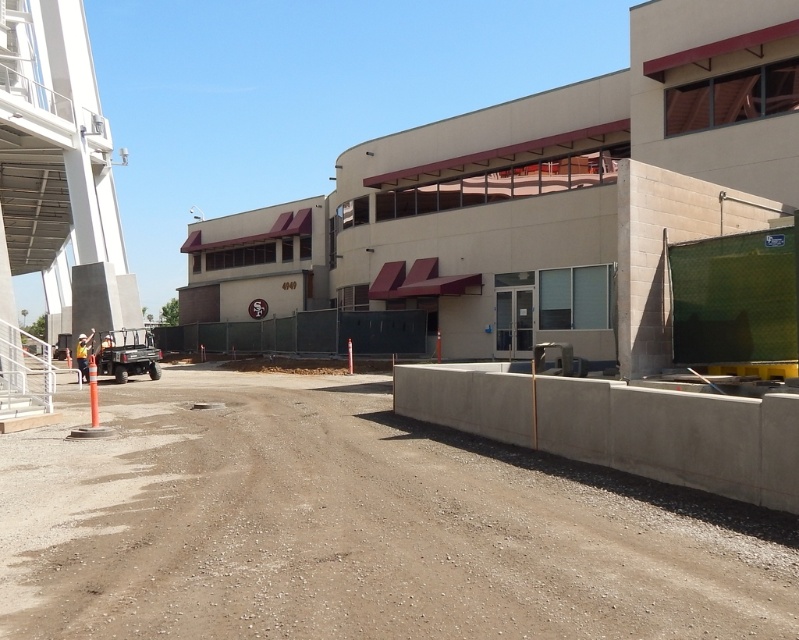
Question: Can you confirm if concrete wall at lower right is bigger than black matte barrier at center?

Choices:
 (A) yes
 (B) no

Answer: (B)

Question: Based on their relative distances, which object is nearer to the black matte barrier at center?

Choices:
 (A) orange reflective vest at left
 (B) concrete wall at lower right
 (C) dirt track at lower left

Answer: (A)

Question: Is dirt track at lower left positioned behind black matte barrier at center?

Choices:
 (A) yes
 (B) no

Answer: (B)

Question: Estimate the real-world distances between objects in this image. Which object is closer to the black matte barrier at center?

Choices:
 (A) concrete wall at lower right
 (B) orange reflective vest at left

Answer: (B)

Question: Is dirt track at lower left thinner than black matte barrier at center?

Choices:
 (A) yes
 (B) no

Answer: (A)

Question: Which of these objects is positioned farthest from the orange reflective vest at left?

Choices:
 (A) dirt track at lower left
 (B) black matte barrier at center
 (C) concrete wall at lower right

Answer: (C)